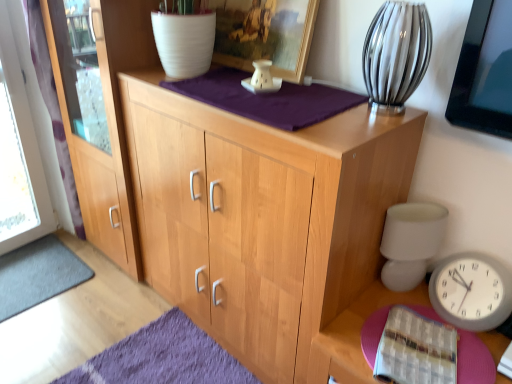
Question: Is natural wood cabinet at center in front of white matte table lamp at right?

Choices:
 (A) yes
 (B) no

Answer: (A)

Question: Is natural wood cabinet at center next to white matte table lamp at right and touching it?

Choices:
 (A) yes
 (B) no

Answer: (B)

Question: From the image's perspective, is natural wood cabinet at center on top of white matte table lamp at right?

Choices:
 (A) yes
 (B) no

Answer: (A)

Question: Would you say natural wood cabinet at center is outside white matte table lamp at right?

Choices:
 (A) no
 (B) yes

Answer: (B)

Question: Is natural wood cabinet at center positioned far away from white matte table lamp at right?

Choices:
 (A) yes
 (B) no

Answer: (B)

Question: From the image's perspective, would you say natural wood cabinet at center is shown under white matte table lamp at right?

Choices:
 (A) no
 (B) yes

Answer: (A)

Question: Can you confirm if pink felt table at lower right is bigger than clear glass vase at upper right?

Choices:
 (A) yes
 (B) no

Answer: (B)

Question: From the image's perspective, does pink felt table at lower right appear higher than clear glass vase at upper right?

Choices:
 (A) yes
 (B) no

Answer: (B)

Question: From a real-world perspective, is pink felt table at lower right on top of clear glass vase at upper right?

Choices:
 (A) no
 (B) yes

Answer: (A)

Question: Considering the relative positions of pink felt table at lower right and clear glass vase at upper right in the image provided, is pink felt table at lower right in front of clear glass vase at upper right?

Choices:
 (A) no
 (B) yes

Answer: (B)

Question: Could you tell me if pink felt table at lower right is facing clear glass vase at upper right?

Choices:
 (A) no
 (B) yes

Answer: (A)

Question: Is pink felt table at lower right not within clear glass vase at upper right?

Choices:
 (A) yes
 (B) no

Answer: (A)

Question: From a real-world perspective, is matte wood screen door at left positioned over white matte table lamp at right based on gravity?

Choices:
 (A) no
 (B) yes

Answer: (B)